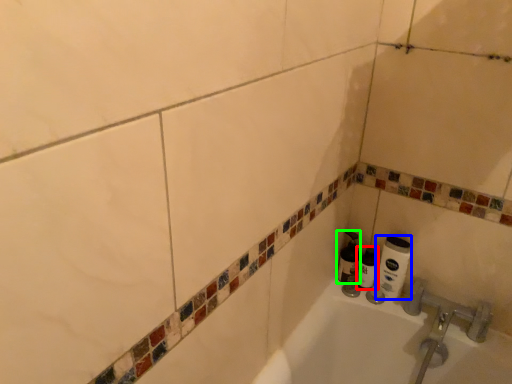
Question: Based on their relative distances, which object is farther from shaving cream (highlighted by a red box)? Choose from toilet paper (highlighted by a blue box) and shaving cream (highlighted by a green box).

Choices:
 (A) toilet paper
 (B) shaving cream

Answer: (A)